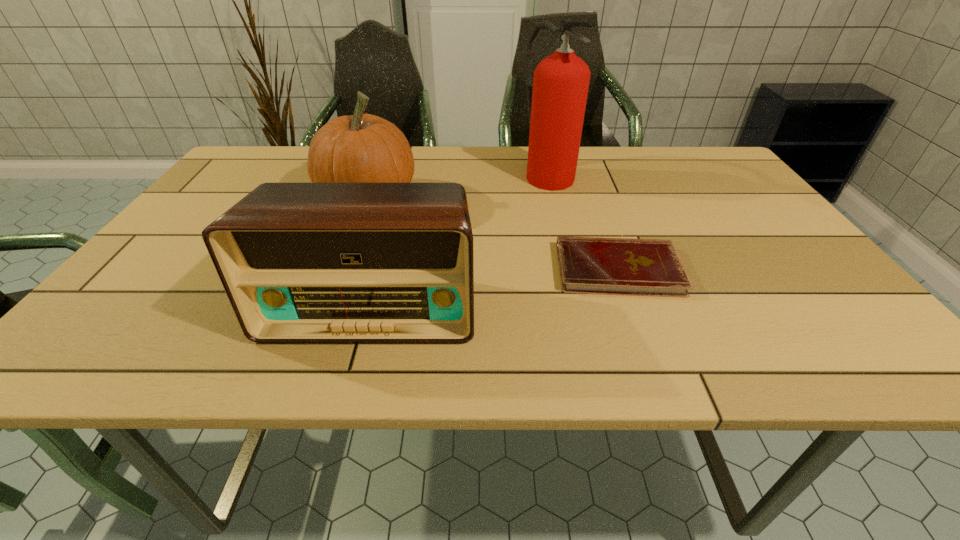
At what (x,y) coordinates should I click in order to perform the action: click on free space at the far edge. Please return your answer as a coordinate pair (x, y). Looking at the image, I should click on (618, 180).

The width and height of the screenshot is (960, 540). I want to click on free spot at the near edge of the desktop, so click(x=673, y=330).

At what (x,y) coordinates should I click in order to perform the action: click on free space at the left edge of the desktop. Please return your answer as a coordinate pair (x, y). Image resolution: width=960 pixels, height=540 pixels. Looking at the image, I should click on (163, 298).

In the image, there is a desktop. At what (x,y) coordinates should I click in order to perform the action: click on vacant space at the far left corner. Please return your answer as a coordinate pair (x, y). Image resolution: width=960 pixels, height=540 pixels. Looking at the image, I should click on (263, 157).

The image size is (960, 540). I want to click on vacant space at the near left corner, so (73, 368).

Where is `vacant space at the far right corner`? vacant space at the far right corner is located at coordinates (708, 184).

Identify the location of empty space between the notebook and the radio receiver. Image resolution: width=960 pixels, height=540 pixels. (494, 289).

This screenshot has height=540, width=960. In order to click on free space between the notebook and the tallest object in this screenshot , I will do `click(583, 221)`.

This screenshot has width=960, height=540. Identify the location of empty space that is in between the radio receiver and the notebook. (494, 289).

Locate an element on the screen. unoccupied position between the pumpkin and the notebook is located at coordinates (493, 235).